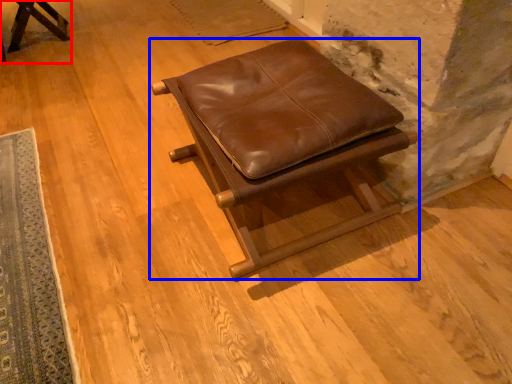
Question: Which object appears farthest to the camera in this image, furniture (highlighted by a red box) or furniture (highlighted by a blue box)?

Choices:
 (A) furniture
 (B) furniture

Answer: (A)